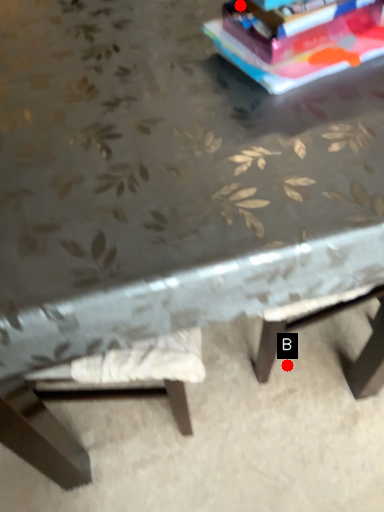
Question: Two points are circled on the image, labeled by A and B beside each circle. Among these points, which one is nearest to the camera?

Choices:
 (A) A is closer
 (B) B is closer

Answer: (A)